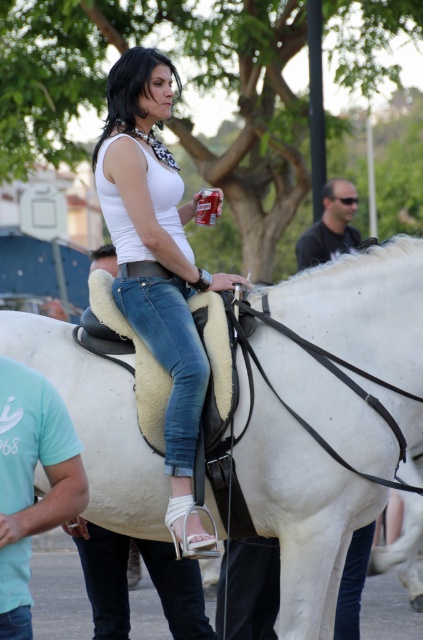
Is white leather saddle at upper center positioned behind white matte tank top at center?

That is True.

Who is more forward, (252, 336) or (162, 60)?

Positioned in front is point (252, 336).

Locate an element on the screen. white leather saddle at upper center is located at coordinates (301, 512).

Between white leather saddle at upper center and matte black shirt at upper right, which one appears on the left side from the viewer's perspective?

white leather saddle at upper center

Which is above, white leather saddle at upper center or matte black shirt at upper right?

matte black shirt at upper right is above.

Which is in front, point (44, 324) or point (342, 211)?

Point (44, 324) is in front.

Identify the location of white leather saddle at upper center. Image resolution: width=423 pixels, height=640 pixels. (301, 512).

Between light blue t-shirt at lower left and matte black shirt at upper right, which one appears on the right side from the viewer's perspective?

From the viewer's perspective, matte black shirt at upper right appears more on the right side.

Between point (5, 598) and point (334, 240), which one is positioned behind?

Point (334, 240)

Find the location of a particular element. light blue t-shirt at lower left is located at coordinates (32, 483).